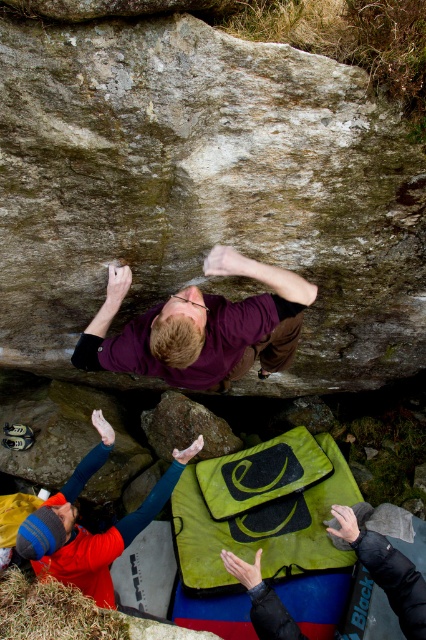
Is purple matte shirt at upper center shorter than yellow fleece jacket at lower left?

Yes, purple matte shirt at upper center is shorter than yellow fleece jacket at lower left.

Can you confirm if purple matte shirt at upper center is taller than yellow fleece jacket at lower left?

No, purple matte shirt at upper center is not taller than yellow fleece jacket at lower left.

Which is in front, point (178, 364) or point (114, 528)?

Point (178, 364) is more forward.

You are a GUI agent. You are given a task and a screenshot of the screen. Output one action in this format:
    pyautogui.click(x=<x>, y=<y>)
    Task: Click on the purple matte shirt at upper center
    
    Given the screenshot: What is the action you would take?
    pyautogui.click(x=201, y=326)